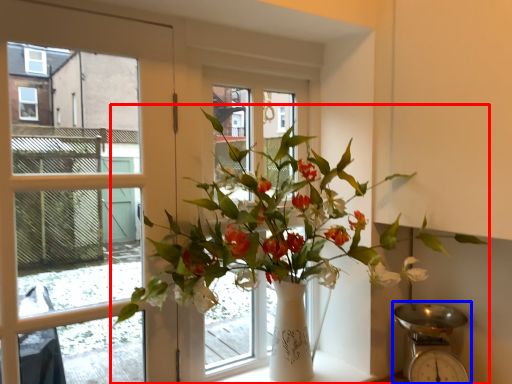
Question: Which of the following is the closest to the observer, houseplant (highlighted by a red box) or scale (highlighted by a blue box)?

Choices:
 (A) houseplant
 (B) scale

Answer: (A)